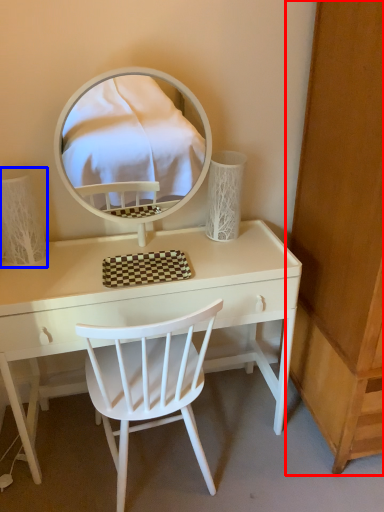
Question: Among these objects, which one is nearest to the camera, dresser (highlighted by a red box) or table lamp (highlighted by a blue box)?

Choices:
 (A) dresser
 (B) table lamp

Answer: (A)